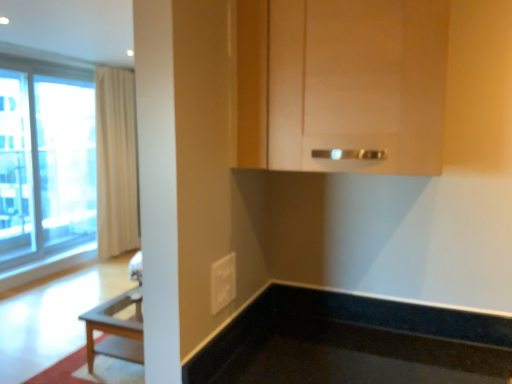
This screenshot has width=512, height=384. Describe the element at coordinates (116, 162) in the screenshot. I see `beige fabric curtain at left` at that location.

What are the coordinates of `white plastic electric outlet at lower center` in the screenshot? It's located at (223, 282).

Identify the location of transparent glass screen door at left. The height and width of the screenshot is (384, 512). (16, 168).

What do you see at coordinates (45, 159) in the screenshot? The image size is (512, 384). I see `transparent glass window at left` at bounding box center [45, 159].

In order to click on matte wood cabinet at upper center in this screenshot , I will do (x=342, y=84).

This screenshot has height=384, width=512. I want to click on beige fabric curtain at left, so click(x=116, y=162).

Does transparent glass window at left have a larger size compared to transparent glass screen door at left?

Incorrect, transparent glass window at left is not larger than transparent glass screen door at left.

From a real-world perspective, who is located lower, transparent glass window at left or transparent glass screen door at left?

In real-world perspective, transparent glass window at left is lower.

Considering the relative positions of transparent glass window at left and transparent glass screen door at left in the image provided, is transparent glass window at left to the left or to the right of transparent glass screen door at left?

Clearly, transparent glass window at left is on the right of transparent glass screen door at left in the image.

Is transparent glass window at left facing away from transparent glass screen door at left?

Yes.

From a real-world perspective, which is physically below, beige fabric curtain at left or transparent glass window at left?

From a 3D spatial view, transparent glass window at left is below.

Between beige fabric curtain at left and transparent glass window at left, which one has less height?

transparent glass window at left.

From the image's perspective, relative to transparent glass window at left, is beige fabric curtain at left above or below?

From the image's perspective, beige fabric curtain at left appears above transparent glass window at left.

Is beige fabric curtain at left facing towards transparent glass window at left?

No, beige fabric curtain at left does not turn towards transparent glass window at left.

Is matte wood cabinet at upper center behind white plastic electric outlet at lower center?

No, the depth of matte wood cabinet at upper center is less than that of white plastic electric outlet at lower center.

Is matte wood cabinet at upper center oriented away from white plastic electric outlet at lower center?

No.

Between matte wood cabinet at upper center and white plastic electric outlet at lower center, which one appears on the right side from the viewer's perspective?

matte wood cabinet at upper center is more to the right.

From the image's perspective, would you say white plastic electric outlet at lower center is shown under transparent glass screen door at left?

Yes, from the image's perspective, white plastic electric outlet at lower center is below transparent glass screen door at left.

Is white plastic electric outlet at lower center placed right next to transparent glass screen door at left?

They are not placed beside each other.

Relative to transparent glass screen door at left, is white plastic electric outlet at lower center in front or behind?

white plastic electric outlet at lower center is in front of transparent glass screen door at left.

From the picture: Could you measure the distance between white plastic electric outlet at lower center and transparent glass screen door at left?

white plastic electric outlet at lower center and transparent glass screen door at left are 3.86 meters apart from each other.

Which is nearer, [429,68] or [31,158]?

Point [429,68] is positioned closer to the camera compared to point [31,158].

Would you consider matte wood cabinet at upper center to be distant from transparent glass screen door at left?

Indeed, matte wood cabinet at upper center is not near transparent glass screen door at left.

Which of these two, matte wood cabinet at upper center or transparent glass screen door at left, stands shorter?

Standing shorter between the two is matte wood cabinet at upper center.

From the image's perspective, would you say white plastic electric outlet at lower center is positioned over matte wood cabinet at upper center?

Actually, white plastic electric outlet at lower center appears below matte wood cabinet at upper center in the image.

Which is in front, point (231, 260) or point (317, 61)?

The point (317, 61) is more forward.

In the scene shown: Is there a large distance between white plastic electric outlet at lower center and matte wood cabinet at upper center?

white plastic electric outlet at lower center is near matte wood cabinet at upper center, not far away.

Is white plastic electric outlet at lower center inside or outside of matte wood cabinet at upper center?

white plastic electric outlet at lower center cannot be found inside matte wood cabinet at upper center.

Could you tell me if transparent glass screen door at left is facing transparent glass window at left?

No.

Is transparent glass screen door at left not within transparent glass window at left?

transparent glass screen door at left is positioned outside transparent glass window at left.

Can you confirm if transparent glass screen door at left is shorter than transparent glass window at left?

In fact, transparent glass screen door at left may be taller than transparent glass window at left.

Identify the location of window that is behind the transparent glass screen door at left. (45, 159).

Where is `curtain lying above the transparent glass window at left (from the image's perspective)`? curtain lying above the transparent glass window at left (from the image's perspective) is located at coordinates (116, 162).

Looking at this image, estimate the real-world distances between objects in this image. Which object is closer to matte wood cabinet at upper center, transparent glass window at left or transparent glass screen door at left?

The object closer to matte wood cabinet at upper center is transparent glass screen door at left.

Looking at the image, which one is located further to transparent glass window at left, transparent glass screen door at left or white plastic electric outlet at lower center?

white plastic electric outlet at lower center is further to transparent glass window at left.

In the scene shown: Looking at the image, which one is located closer to transparent glass window at left, transparent glass screen door at left or matte wood cabinet at upper center?

transparent glass screen door at left lies closer to transparent glass window at left than the other object.

Based on their spatial positions, is beige fabric curtain at left or transparent glass window at left further from white plastic electric outlet at lower center?

Based on the image, transparent glass window at left appears to be further to white plastic electric outlet at lower center.

Based on the photo, estimate the real-world distances between objects in this image. Which object is closer to transparent glass screen door at left, transparent glass window at left or white plastic electric outlet at lower center?

The object closer to transparent glass screen door at left is transparent glass window at left.

Considering their positions, is matte wood cabinet at upper center positioned closer to transparent glass window at left than white plastic electric outlet at lower center?

white plastic electric outlet at lower center is closer to transparent glass window at left.

When comparing their distances from matte wood cabinet at upper center, does transparent glass window at left or white plastic electric outlet at lower center seem further?

transparent glass window at left is further to matte wood cabinet at upper center.

Based on their spatial positions, is transparent glass screen door at left or matte wood cabinet at upper center further from white plastic electric outlet at lower center?

transparent glass screen door at left is positioned further to the anchor white plastic electric outlet at lower center.

At what (x,y) coordinates should I click in order to perform the action: click on electric outlet between matte wood cabinet at upper center and beige fabric curtain at left in the front-back direction. Please return your answer as a coordinate pair (x, y). This screenshot has width=512, height=384. Looking at the image, I should click on (223, 282).

You are a GUI agent. You are given a task and a screenshot of the screen. Output one action in this format:
    pyautogui.click(x=<x>, y=<y>)
    Task: Click on the screen door between matte wood cabinet at upper center and beige fabric curtain at left along the z-axis
    This screenshot has height=384, width=512.
    Given the screenshot: What is the action you would take?
    pyautogui.click(x=16, y=168)

I want to click on screen door between matte wood cabinet at upper center and transparent glass window at left along the z-axis, so click(x=16, y=168).

Locate an element on the screen. The width and height of the screenshot is (512, 384). window between transparent glass screen door at left and beige fabric curtain at left along the z-axis is located at coordinates (45, 159).